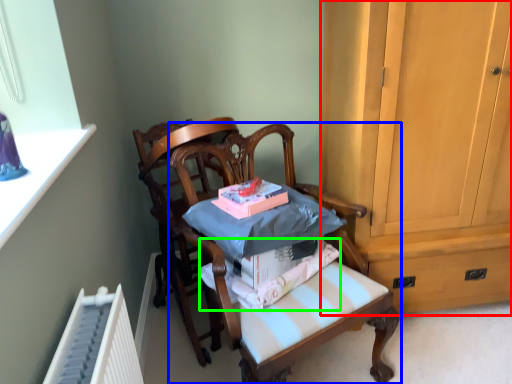
Question: Considering the real-world distances, which object is farthest from cabinetry (highlighted by a red box)? chair (highlighted by a blue box) or fabric (highlighted by a green box)?

Choices:
 (A) chair
 (B) fabric

Answer: (B)